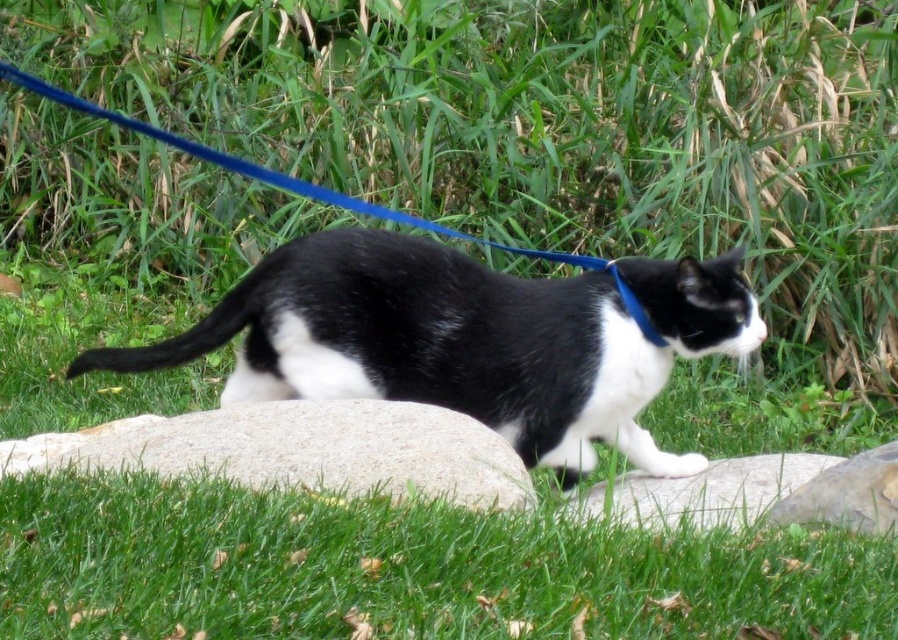
You are standing at the point marked by the coordinates point (x=406, y=570) in the image. Looking around, you see the black and white cat with blue harness. Which direction should you walk to reach the cat?

The point (x=406, y=570) is at the lower center and marks green grass at lower center. The cat is walking on the grassy area, so you should walk north or towards the upper part of the image to reach the cat.